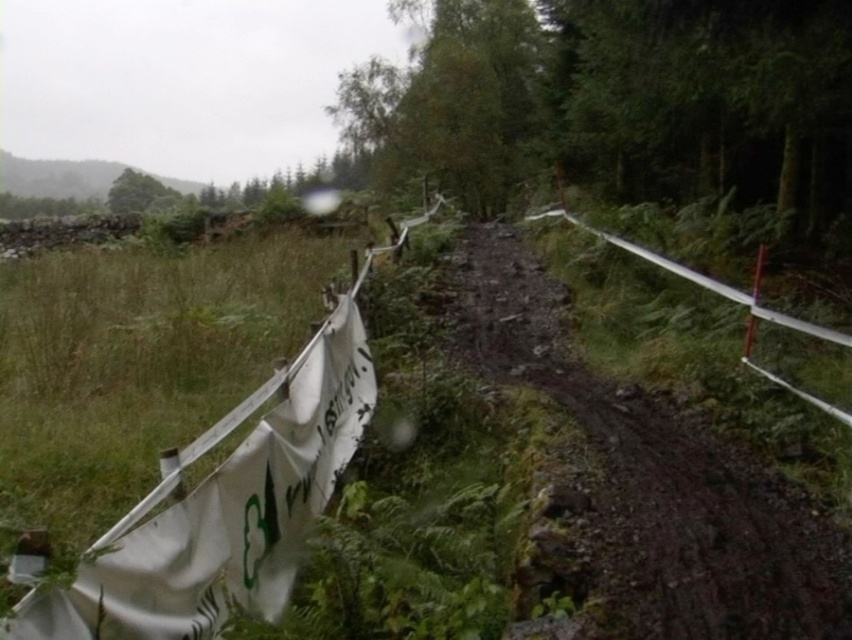
Question: Is dull brown dirt track at center further to the viewer compared to white fabric banner at left?

Choices:
 (A) no
 (B) yes

Answer: (B)

Question: Estimate the real-world distances between objects in this image. Which object is farther from the dull brown dirt track at center?

Choices:
 (A) metallic silver fence at center-right
 (B) white fabric banner at left

Answer: (B)

Question: Which object appears farthest from the camera in this image?

Choices:
 (A) white fabric banner at left
 (B) green leafy tree at upper left
 (C) dull brown dirt track at center

Answer: (B)

Question: Observing the image, what is the correct spatial positioning of white fabric banner at left in reference to metallic silver fence at center-right?

Choices:
 (A) left
 (B) right

Answer: (A)

Question: Observing the image, what is the correct spatial positioning of metallic silver fence at center-right in reference to green leafy tree at upper left?

Choices:
 (A) left
 (B) right

Answer: (B)

Question: Which object appears closest to the camera in this image?

Choices:
 (A) green leafy tree at upper left
 (B) dull brown dirt track at center

Answer: (B)